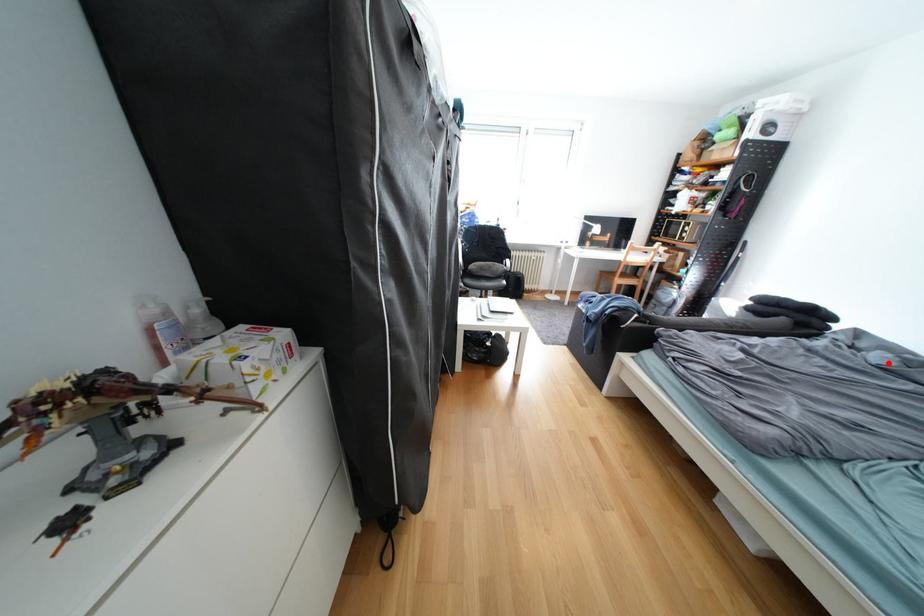
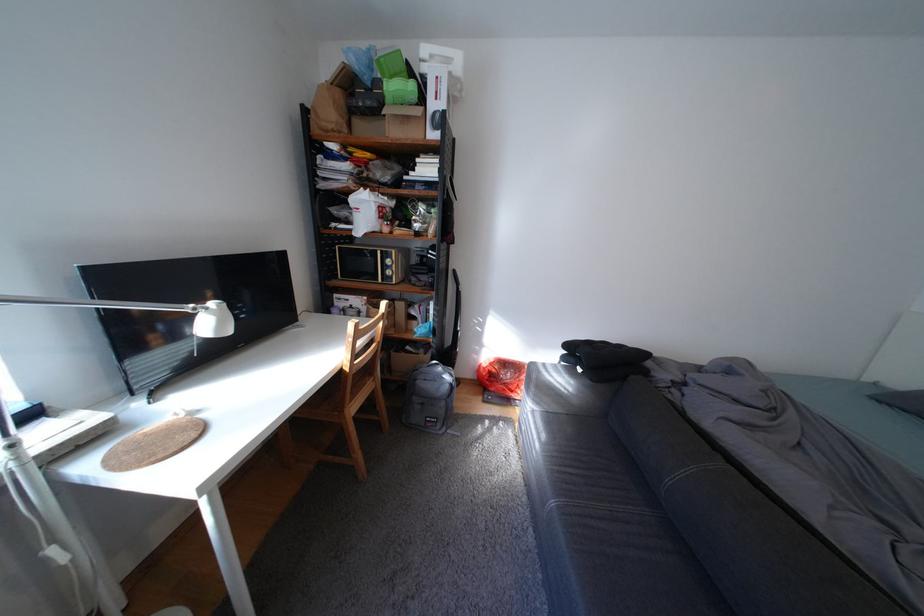
Question: I am providing you with two images of the same scene from different viewpoints. A red point is shown in image1. For the corresponding object point in image2, is it positioned nearer or farther from the camera?

Choices:
 (A) Nearer
 (B) Farther

Answer: (A)